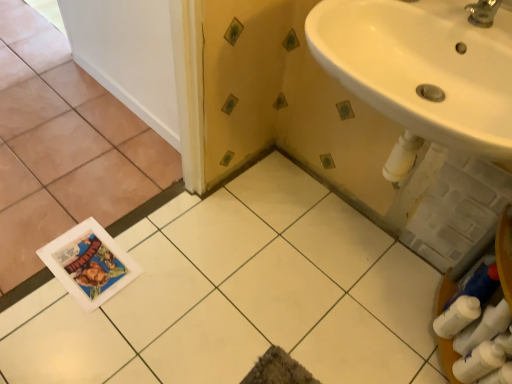
Identify the location of free space to the back side of white matte toilet paper at lower right. The image size is (512, 384). (415, 286).